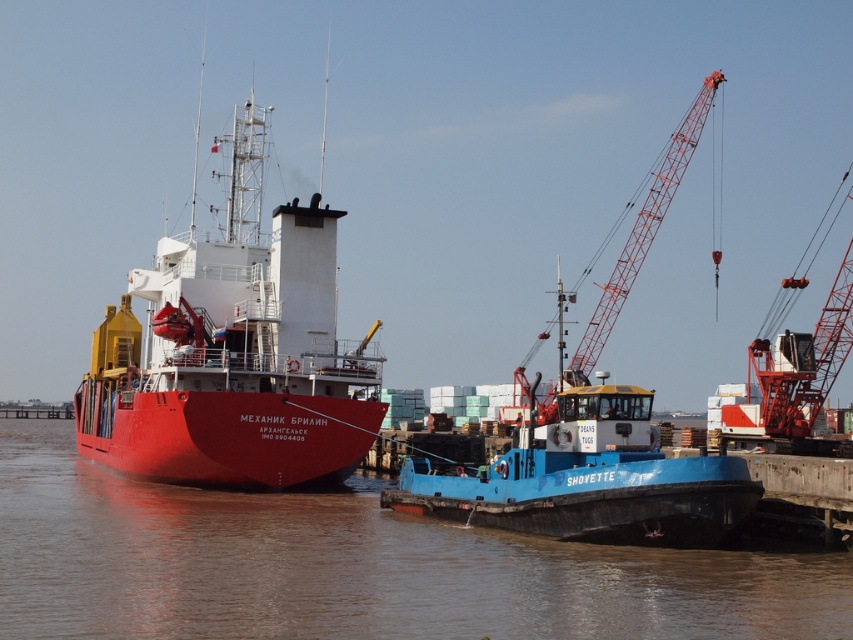
Is point (18, 538) farther from viewer compared to point (119, 385)?

No, (18, 538) is in front of (119, 385).

Who is shorter, brown matte water at lower left or shiny red ship at center?

Standing shorter between the two is brown matte water at lower left.

Which is behind, point (35, 520) or point (253, 472)?

The point (253, 472) is more distant.

Find the location of a particular element. brown matte water at lower left is located at coordinates (354, 566).

Does shiny red ship at center appear on the right side of blue matte tugboat at center?

In fact, shiny red ship at center is to the left of blue matte tugboat at center.

Who is lower down, shiny red ship at center or blue matte tugboat at center?

Positioned lower is blue matte tugboat at center.

Which is behind, point (339, 424) or point (532, 452)?

Positioned behind is point (339, 424).

Find the location of a particular element. The height and width of the screenshot is (640, 853). shiny red ship at center is located at coordinates (233, 353).

Is shiny red ship at center behind orange metallic crane at upper right?

Yes, shiny red ship at center is further from the viewer.

Between point (366, 390) and point (701, 113), which one is positioned behind?

Point (701, 113)

Find the location of a particular element. The width and height of the screenshot is (853, 640). shiny red ship at center is located at coordinates (233, 353).